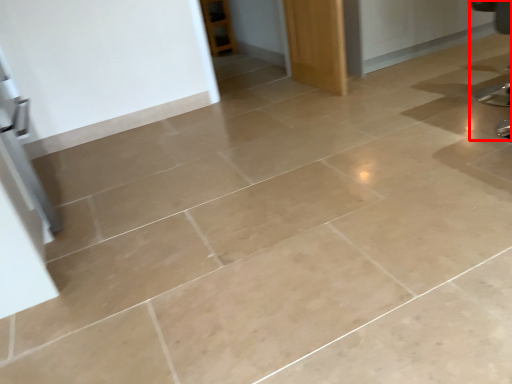
Question: From the image's perspective, what is the correct spatial relationship of swivel chair (annotated by the red box) in relation to door?

Choices:
 (A) above
 (B) below

Answer: (B)